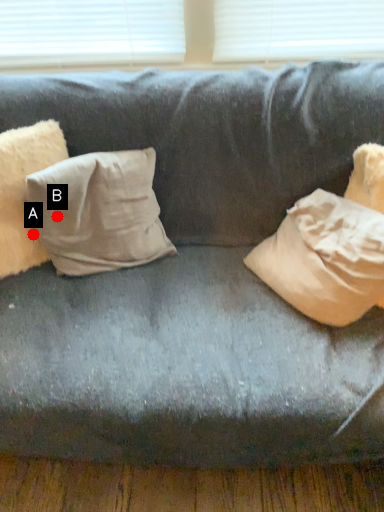
Question: Two points are circled on the image, labeled by A and B beside each circle. Which point is closer to the camera?

Choices:
 (A) A is closer
 (B) B is closer

Answer: (B)